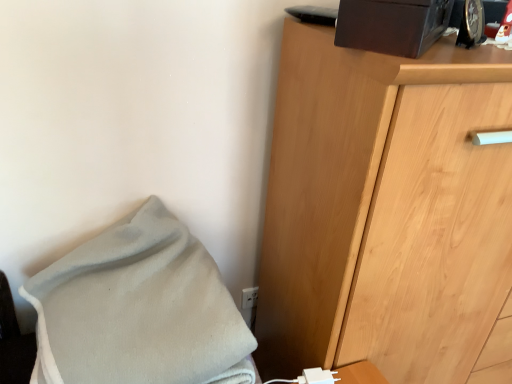
Question: Looking at the image, does light brown wooden chest of drawers at right seem bigger or smaller compared to white fleece blanket at lower left?

Choices:
 (A) small
 (B) big

Answer: (B)

Question: Is light brown wooden chest of drawers at right in front of or behind white fleece blanket at lower left in the image?

Choices:
 (A) front
 (B) behind

Answer: (B)

Question: Which of these objects is positioned closest to the light brown wooden chest of drawers at right?

Choices:
 (A) white plastic electric outlet at lower center
 (B) white fleece blanket at lower left

Answer: (B)

Question: Estimate the real-world distances between objects in this image. Which object is closer to the light brown wooden chest of drawers at right?

Choices:
 (A) white fleece blanket at lower left
 (B) white plastic electric outlet at lower center

Answer: (A)